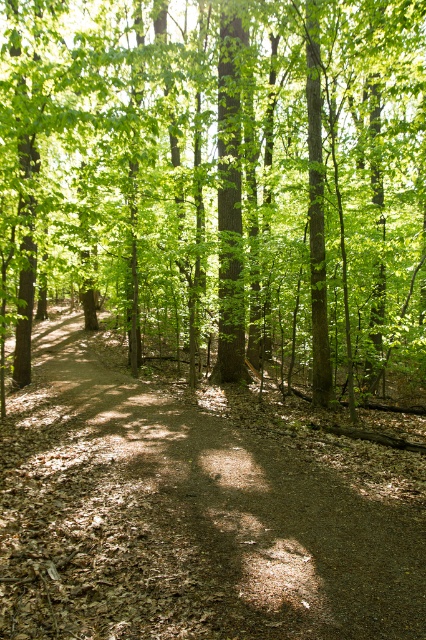
Between green leafy tree at center and dirt path at center, which one is positioned higher?

green leafy tree at center is higher up.

Can you confirm if green leafy tree at center is positioned to the left of dirt path at center?

Incorrect, green leafy tree at center is not on the left side of dirt path at center.

Is point (371, 13) behind point (178, 417)?

Yes, point (371, 13) is behind point (178, 417).

Locate an element on the screen. green leafy tree at center is located at coordinates (221, 180).